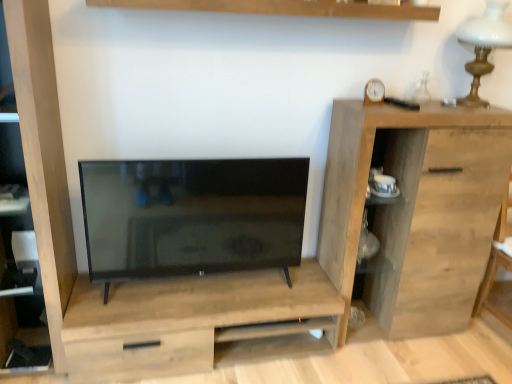
Question: Is matte black tv at center facing towards light wood dresser at center?

Choices:
 (A) no
 (B) yes

Answer: (A)

Question: Does matte black tv at center have a greater height compared to light wood dresser at center?

Choices:
 (A) no
 (B) yes

Answer: (B)

Question: From a real-world perspective, is matte black tv at center located higher than light wood dresser at center?

Choices:
 (A) yes
 (B) no

Answer: (A)

Question: Does matte black tv at center have a lesser height compared to light wood dresser at center?

Choices:
 (A) yes
 (B) no

Answer: (B)

Question: Is matte black tv at center beside light wood dresser at center?

Choices:
 (A) yes
 (B) no

Answer: (B)

Question: From a real-world perspective, does matte black tv at center sit lower than light wood dresser at center?

Choices:
 (A) no
 (B) yes

Answer: (A)

Question: Does white glass table lamp at upper right have a greater width compared to wooden shelf at upper center?

Choices:
 (A) no
 (B) yes

Answer: (B)

Question: From a real-world perspective, is white glass table lamp at upper right below wooden shelf at upper center?

Choices:
 (A) yes
 (B) no

Answer: (A)

Question: Does white glass table lamp at upper right lie behind wooden shelf at upper center?

Choices:
 (A) yes
 (B) no

Answer: (A)

Question: Can you confirm if white glass table lamp at upper right is shorter than wooden shelf at upper center?

Choices:
 (A) yes
 (B) no

Answer: (B)

Question: Is white glass table lamp at upper right positioned far away from wooden shelf at upper center?

Choices:
 (A) yes
 (B) no

Answer: (B)

Question: From the image's perspective, is white glass table lamp at upper right located above wooden shelf at upper center?

Choices:
 (A) yes
 (B) no

Answer: (B)

Question: Does natural wood cabinet at right have a greater width compared to wooden shelf at upper center?

Choices:
 (A) yes
 (B) no

Answer: (A)